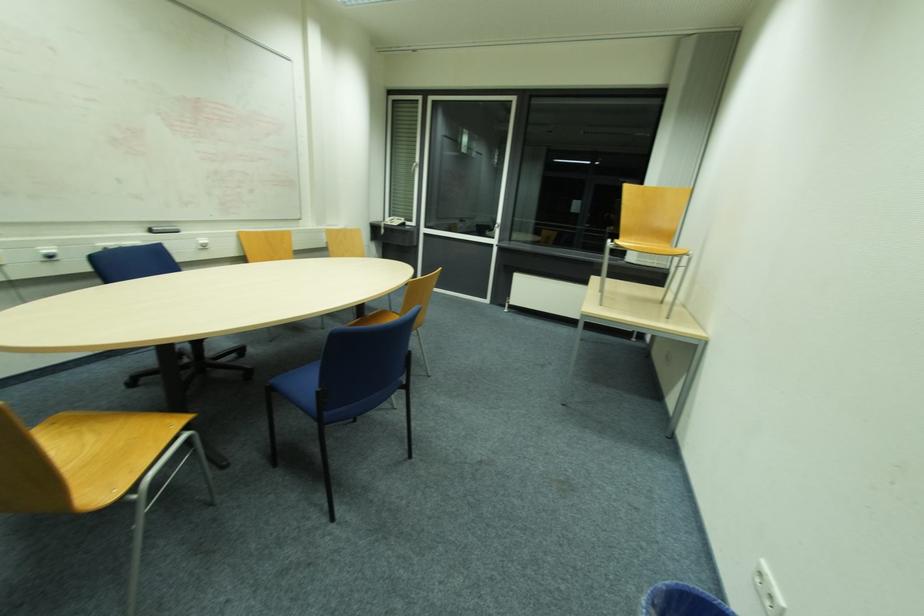
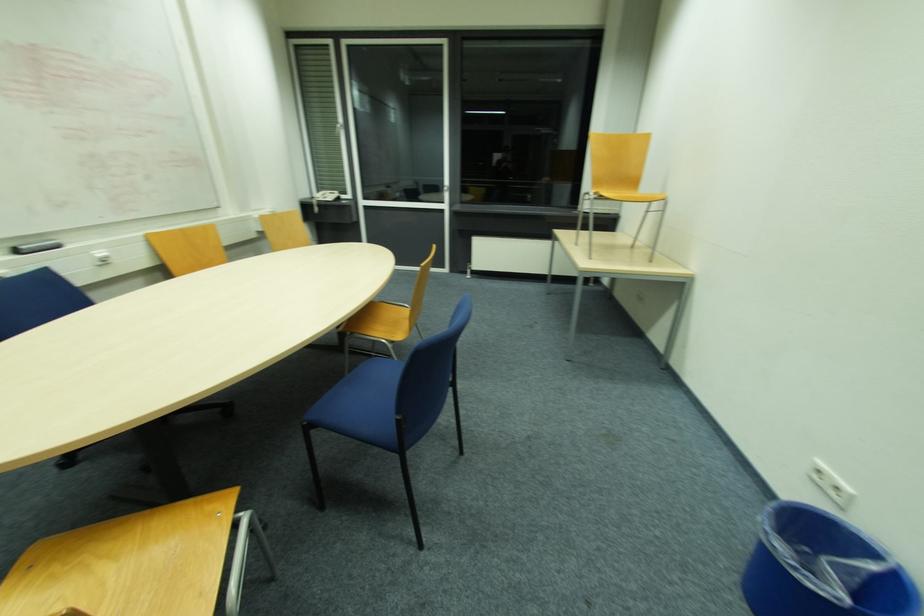
Question: The camera is either moving clockwise (left) or counter-clockwise (right) around the object. The first image is from the beginning of the video and the second image is from the end. Is the camera moving left or right when shooting the video?

Choices:
 (A) Left
 (B) Right

Answer: (A)